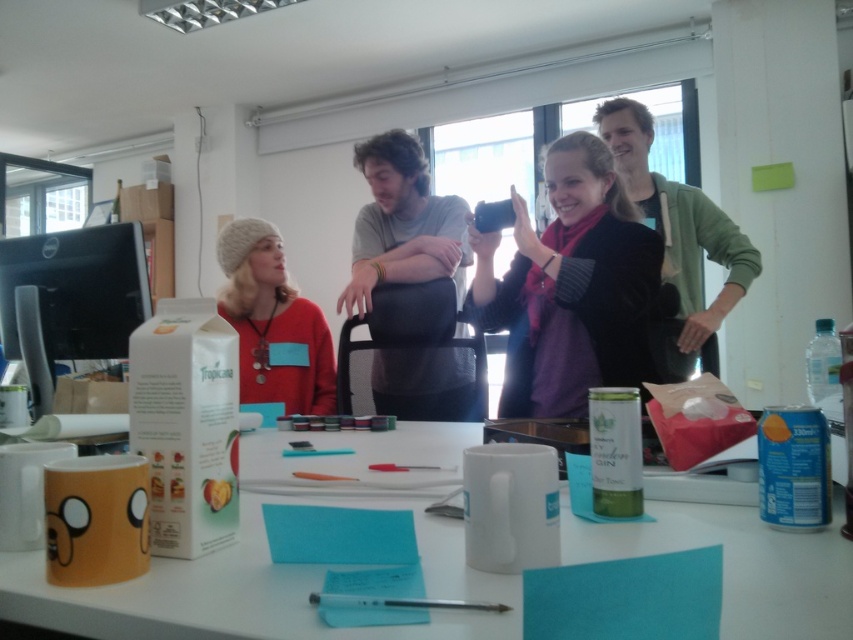
Question: Which point is closer to the camera?

Choices:
 (A) tap(351, 628)
 (B) tap(0, 282)

Answer: (A)

Question: Which object is the farthest from the black glossy monitor at left?

Choices:
 (A) green fleece jacket at upper right
 (B) gray cotton shirt at center

Answer: (A)

Question: Observing the image, what is the correct spatial positioning of black glossy monitor at left in reference to knitted wool beanie at upper left?

Choices:
 (A) below
 (B) above

Answer: (B)

Question: Can you confirm if gray cotton shirt at center is wider than green fleece jacket at upper right?

Choices:
 (A) no
 (B) yes

Answer: (A)

Question: Is green fleece jacket at upper right positioned behind knitted wool beanie at upper left?

Choices:
 (A) no
 (B) yes

Answer: (A)

Question: Which object is positioned closest to the black glossy monitor at left?

Choices:
 (A) green fleece jacket at upper right
 (B) white matte table at center
 (C) gray cotton shirt at center

Answer: (B)